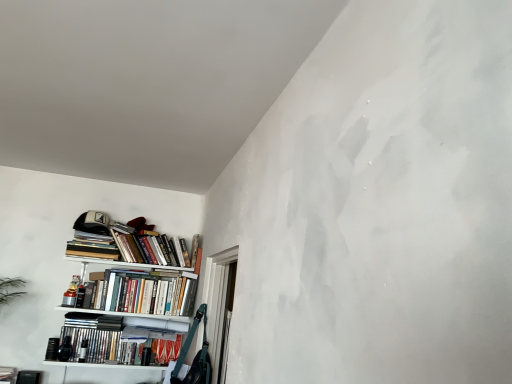
Question: Considering the relative positions of hardcover books at center, the 2th book ordered from the bottom, and transparent plastic window at lower left in the image provided, is hardcover books at center, the 2th book ordered from the bottom, behind transparent plastic window at lower left?

Choices:
 (A) yes
 (B) no

Answer: (A)

Question: Is hardcover books at center, which is counted as the third book, starting from the top, closer to the viewer compared to transparent plastic window at lower left?

Choices:
 (A) no
 (B) yes

Answer: (A)

Question: Considering the relative sizes of hardcover books at center, the 2th book ordered from the bottom, and transparent plastic window at lower left in the image provided, is hardcover books at center, the 2th book ordered from the bottom, bigger than transparent plastic window at lower left?

Choices:
 (A) yes
 (B) no

Answer: (B)

Question: Is hardcover books at center, which is counted as the third book, starting from the top, oriented towards transparent plastic window at lower left?

Choices:
 (A) no
 (B) yes

Answer: (B)

Question: From the image's perspective, is hardcover books at center, which is counted as the third book, starting from the top, above transparent plastic window at lower left?

Choices:
 (A) no
 (B) yes

Answer: (B)

Question: Does hardcover books at center, which is counted as the third book, starting from the top, have a smaller size compared to transparent plastic window at lower left?

Choices:
 (A) no
 (B) yes

Answer: (B)

Question: Is white matte bookshelf at left facing towards hardcover books at left, arranged as the 4th book when ordered from the bottom?

Choices:
 (A) yes
 (B) no

Answer: (B)

Question: Does white matte bookshelf at left appear on the right side of hardcover books at left, the 1th book from the top?

Choices:
 (A) no
 (B) yes

Answer: (B)

Question: Considering the relative positions of white matte bookshelf at left and hardcover books at left, the 1th book from the top, in the image provided, is white matte bookshelf at left behind hardcover books at left, the 1th book from the top,?

Choices:
 (A) yes
 (B) no

Answer: (B)

Question: Is hardcover books at left, arranged as the 4th book when ordered from the bottom, located within white matte bookshelf at left?

Choices:
 (A) yes
 (B) no

Answer: (B)

Question: Would you say white matte bookshelf at left is a long distance from hardcover books at left, arranged as the 4th book when ordered from the bottom?

Choices:
 (A) no
 (B) yes

Answer: (A)

Question: Considering the relative sizes of white matte bookshelf at left and hardcover books at left, the 1th book from the top, in the image provided, is white matte bookshelf at left taller than hardcover books at left, the 1th book from the top,?

Choices:
 (A) no
 (B) yes

Answer: (B)

Question: Is hardcover books at center, the 2th book ordered from the bottom, closer to the viewer compared to white matte bookshelf at left?

Choices:
 (A) no
 (B) yes

Answer: (A)